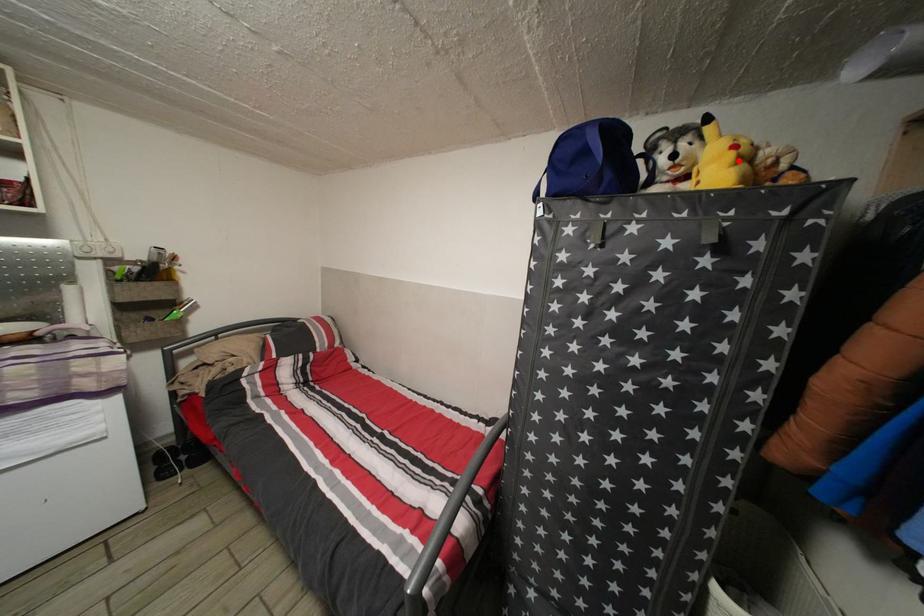
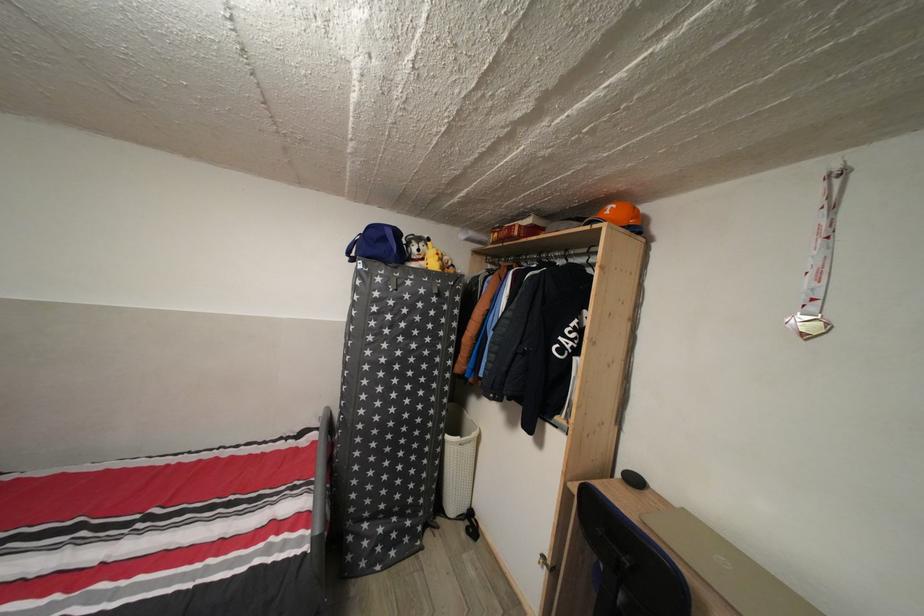
Find the pixel in the second image that matches the highlighted location in the first image.

(444, 264)